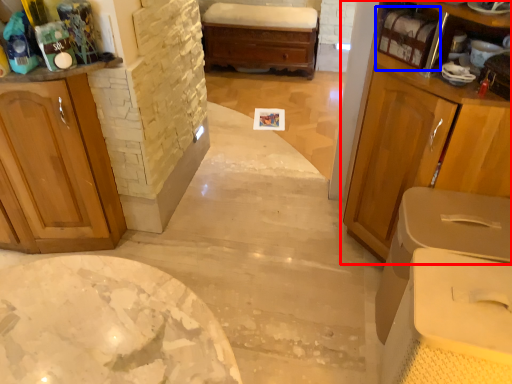
Question: Which point is closer to the camera, cabinetry (highlighted by a red box) or shelf (highlighted by a blue box)?

Choices:
 (A) cabinetry
 (B) shelf

Answer: (A)